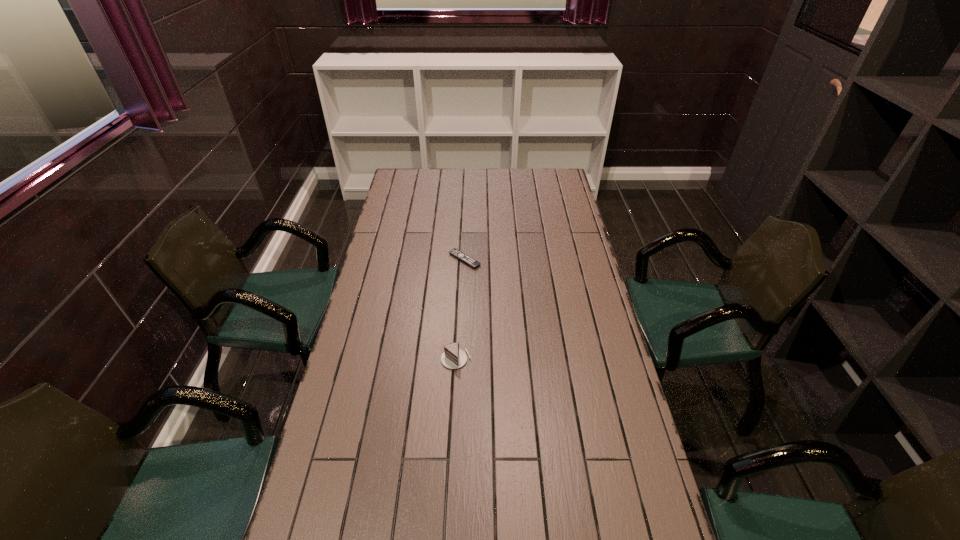
At what (x,y) coordinates should I click in order to perform the action: click on the nearer object. Please return your answer as a coordinate pair (x, y). Looking at the image, I should click on (453, 357).

The height and width of the screenshot is (540, 960). Find the location of `the taller object`. the taller object is located at coordinates (453, 357).

Image resolution: width=960 pixels, height=540 pixels. I want to click on the shorter object, so click(458, 254).

Identify the location of remote control. (458, 254).

You are a GUI agent. You are given a task and a screenshot of the screen. Output one action in this format:
    pyautogui.click(x=<x>, y=<y>)
    Task: Click on the vacant space located on the back of the nearer object
    
    Given the screenshot: What is the action you would take?
    pyautogui.click(x=460, y=278)

Where is `vacant region located on the front of the shorter object`? The image size is (960, 540). vacant region located on the front of the shorter object is located at coordinates (463, 294).

This screenshot has width=960, height=540. What are the coordinates of `vacant space at the far edge of the desktop` in the screenshot? It's located at (428, 188).

At what (x,y) coordinates should I click in order to perform the action: click on free space at the left edge. Please return your answer as a coordinate pair (x, y). The height and width of the screenshot is (540, 960). Looking at the image, I should click on (359, 321).

I want to click on free space at the right edge, so click(x=551, y=219).

The width and height of the screenshot is (960, 540). Identify the location of vacant space at the far left corner of the desktop. (399, 185).